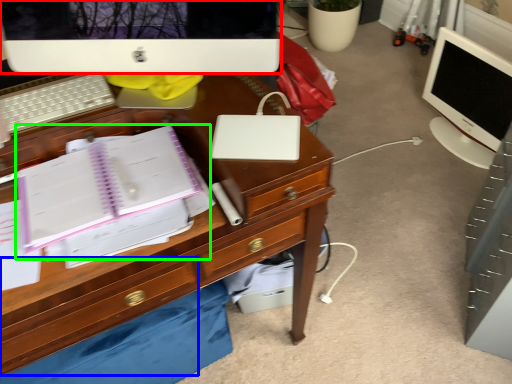
Question: Which is nearer to the computer monitor (highlighted by a red box)? drawer (highlighted by a blue box) or notebook (highlighted by a green box).

Choices:
 (A) drawer
 (B) notebook

Answer: (B)